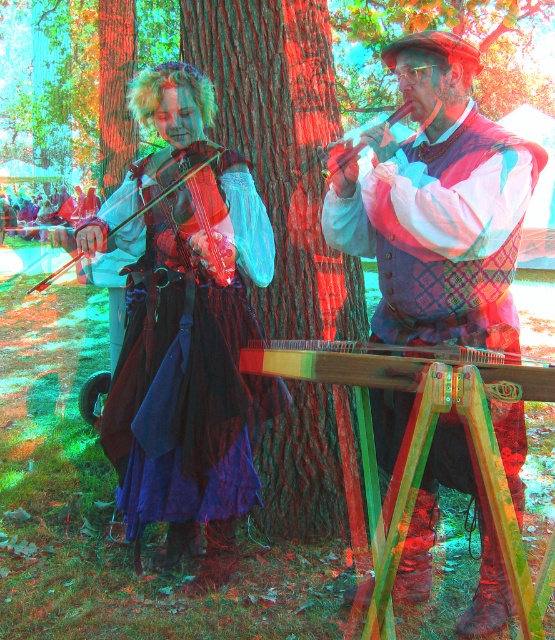
Question: Does brown rough tree trunk at center come in front of matte black violin at left?

Choices:
 (A) no
 (B) yes

Answer: (A)

Question: Which point appears farthest from the camera in this image?

Choices:
 (A) (421, 337)
 (B) (344, 161)
 (C) (295, 452)

Answer: (C)

Question: Is plaid fabric vest at center below matte black violin at left?

Choices:
 (A) no
 (B) yes

Answer: (B)

Question: Estimate the real-world distances between objects in this image. Which object is closer to the matte black violin at left?

Choices:
 (A) velvet purple dress at center
 (B) plaid fabric vest at center
 (C) wooden harp at center
 (D) matte black violin at upper center

Answer: (A)

Question: Estimate the real-world distances between objects in this image. Which object is closer to the matte black violin at left?

Choices:
 (A) wooden harp at center
 (B) matte black violin at upper center
 (C) plaid fabric vest at center
 (D) velvet purple dress at center

Answer: (D)

Question: Is plaid fabric vest at center to the left of brown rough tree trunk at center from the viewer's perspective?

Choices:
 (A) yes
 (B) no

Answer: (B)